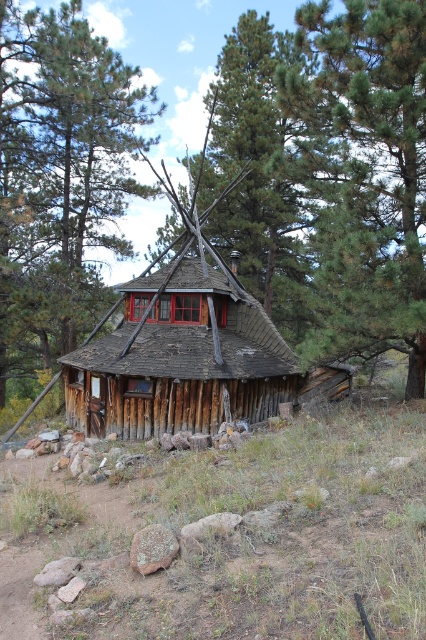
Question: Is green pine tree at upper center in front of brown wooden cabin at center?

Choices:
 (A) no
 (B) yes

Answer: (B)

Question: Is green textured pine trees at upper center to the right of green pine tree at upper center from the viewer's perspective?

Choices:
 (A) no
 (B) yes

Answer: (A)

Question: Among these points, which one is nearest to the camera?

Choices:
 (A) (307, 113)
 (B) (296, 173)
 (C) (20, 284)

Answer: (A)

Question: Is green textured pine trees at upper center positioned at the back of green pine tree at upper center?

Choices:
 (A) yes
 (B) no

Answer: (A)

Question: Estimate the real-world distances between objects in this image. Which object is farther from the green textured pine trees at upper center?

Choices:
 (A) brown wooden cabin at center
 (B) green pine tree at upper center

Answer: (A)

Question: Among these objects, which one is nearest to the camera?

Choices:
 (A) green pine tree at upper center
 (B) brown wooden cabin at center

Answer: (A)